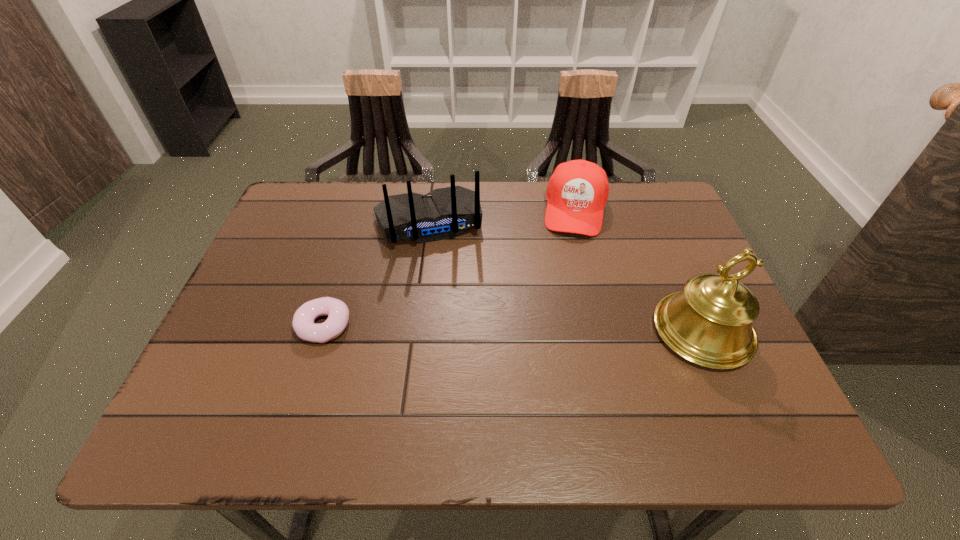
The image size is (960, 540). What are the coordinates of `free space at the far edge of the desktop` in the screenshot? It's located at (506, 223).

Image resolution: width=960 pixels, height=540 pixels. Find the location of `free space at the near edge of the desktop`. free space at the near edge of the desktop is located at coordinates (502, 401).

Find the location of a particular element. free spot at the left edge of the desktop is located at coordinates (281, 237).

In the image, there is a desktop. Where is `free space at the right edge`? The image size is (960, 540). free space at the right edge is located at coordinates (647, 240).

This screenshot has width=960, height=540. I want to click on vacant space at the far left corner of the desktop, so click(x=299, y=217).

At what (x,y) coordinates should I click in order to perform the action: click on free location at the near left corner. Please return your answer as a coordinate pair (x, y). The image size is (960, 540). Looking at the image, I should click on (283, 366).

Locate an element on the screen. The width and height of the screenshot is (960, 540). vacant area between the bell and the shortest object is located at coordinates (514, 328).

Image resolution: width=960 pixels, height=540 pixels. I want to click on empty location between the second object from right to left and the second tallest object, so click(501, 216).

You are a GUI agent. You are given a task and a screenshot of the screen. Output one action in this format:
    pyautogui.click(x=<x>, y=<y>)
    Task: Click on the free area in between the third object from left to right and the rightmost object
    
    Given the screenshot: What is the action you would take?
    pyautogui.click(x=638, y=271)

At what (x,y) coordinates should I click in order to perform the action: click on free area in between the second object from right to left and the shortest object. Please return your answer as a coordinate pair (x, y). Looking at the image, I should click on (449, 267).